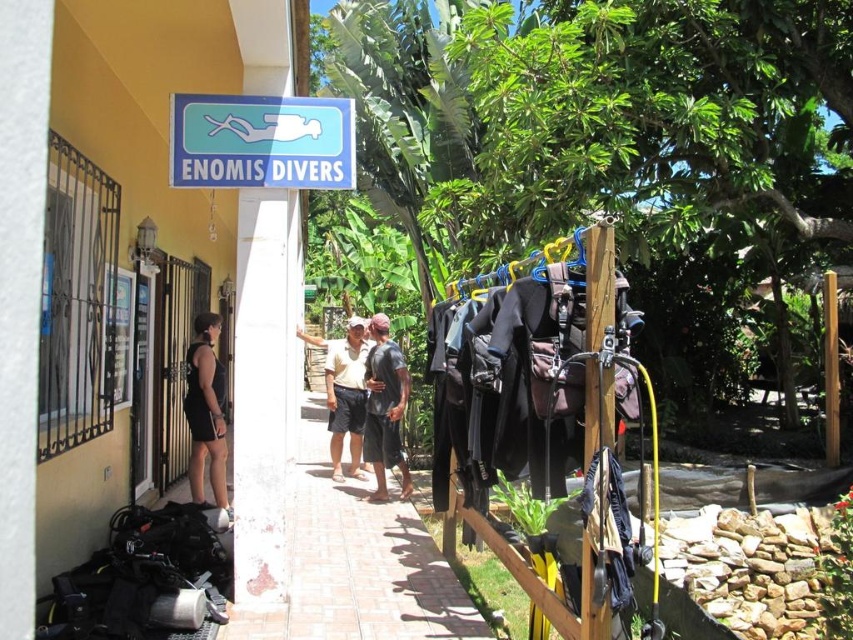
You are standing at the entrance of Enomis Divers and want to take a photo that includes both the point at coordinates point (376, 556) and point (256, 97). Which point should you focus on to ensure both are in focus?

You should focus on point (256, 97) because it is closer to the camera than point (376, 556). By focusing on the closer point, both points will be within the depth of field and in focus.

You are a customer at Enomis Divers and you want to buy a pole that is the same size as your shorts. Based on the scene, can you determine if the wooden pole at center is a suitable size for your black cotton shorts at center?

The wooden pole at center has a smaller size compared to black cotton shorts at center, so it is not suitable as it is smaller than the required size.